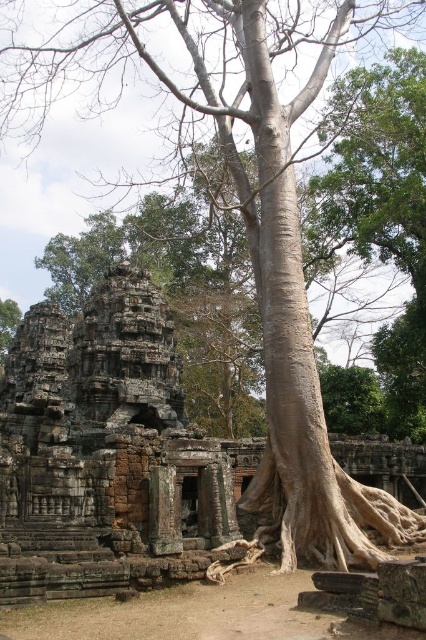
You are standing in front of the ancient stone structure and want to touch the brown rough tree root at center. Is the brown stone ruins at center blocking your direct path to the root?

The brown stone ruins at center is closer to the viewer than the brown rough tree root at center, so yes, the brown stone ruins at center is blocking the direct path to the root.

You are an archaeologist examining the ancient site. You notice the brown stone ruins at center and the brown rough tree root at center. Based on their positions, which one is located to the left side of the other?

The brown stone ruins at center are to the left of the brown rough tree root at center.